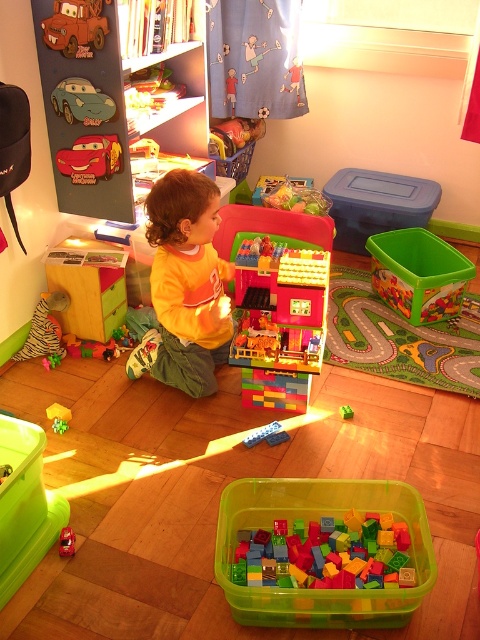
Question: From the image, what is the correct spatial relationship of matte yellow shirt at center in relation to metallic red car at left?

Choices:
 (A) above
 (B) below

Answer: (B)

Question: Among these objects, which one is nearest to the camera?

Choices:
 (A) metallic silver car at center
 (B) metallic red car at left
 (C) metallic green car at upper left

Answer: (A)

Question: Considering the relative positions of metallic green car at upper left and metallic silver car at center in the image provided, where is metallic green car at upper left located with respect to metallic silver car at center?

Choices:
 (A) left
 (B) right

Answer: (A)

Question: Estimate the real-world distances between objects in this image. Which object is farther from the green matte block at center?

Choices:
 (A) matte yellow shirt at center
 (B) metallic red car at left
 (C) metallic red car at upper left

Answer: (C)

Question: Estimate the real-world distances between objects in this image. Which object is closer to the metallic silver car at center?

Choices:
 (A) metallic green car at upper left
 (B) green matte block at center
 (C) matte yellow shirt at center

Answer: (C)

Question: Can you confirm if metallic red car at upper left is positioned to the left of green matte block at center?

Choices:
 (A) yes
 (B) no

Answer: (A)